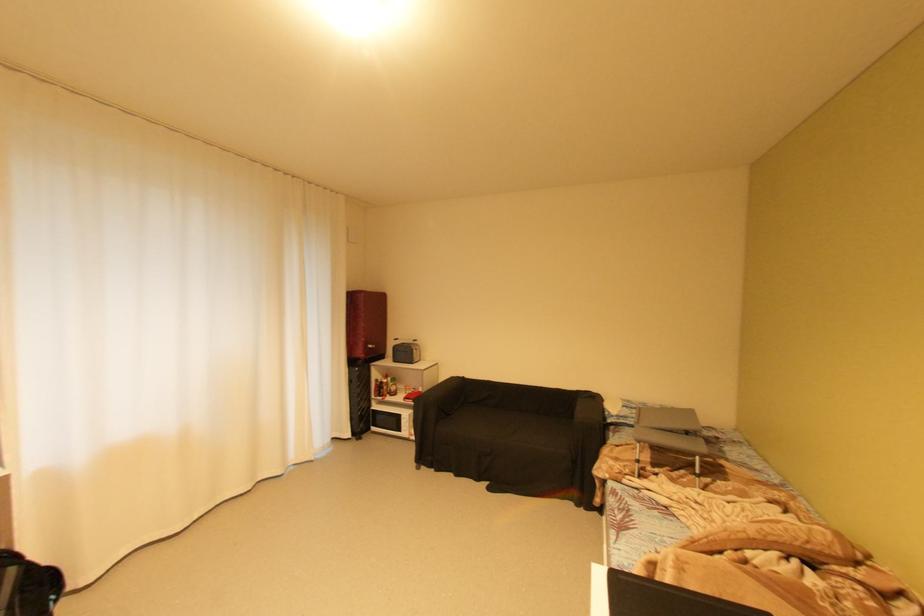
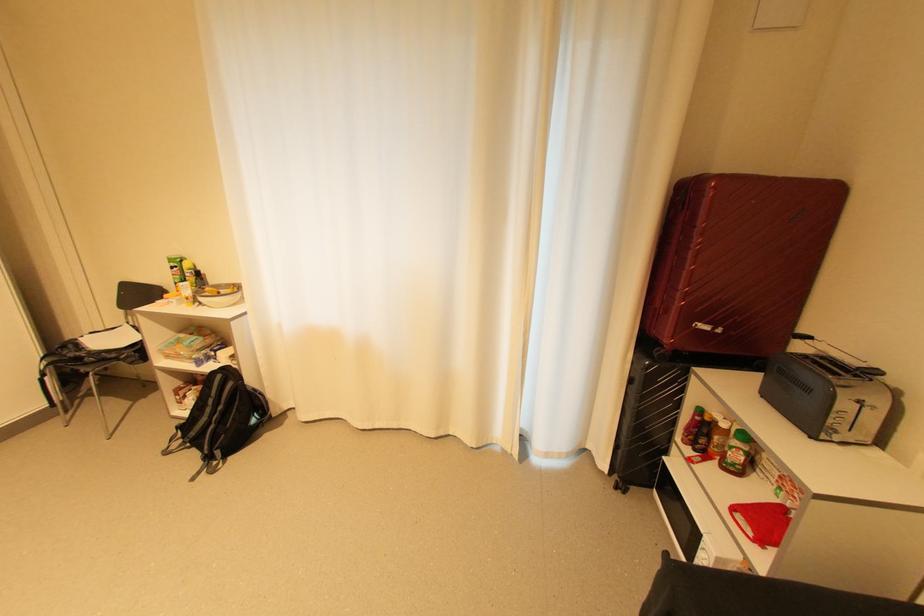
Locate, in the second image, the point that corresponds to point 359,382 in the first image.

(638, 381)